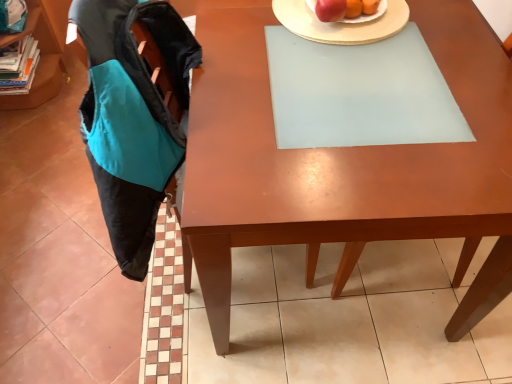
Where is `free space in front of shiny red apple at upper center`? free space in front of shiny red apple at upper center is located at coordinates (356, 45).